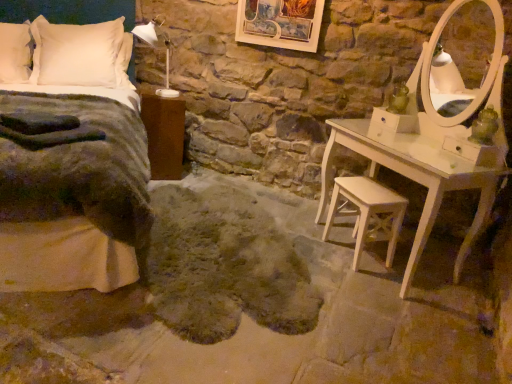
The image size is (512, 384). What do you see at coordinates (368, 211) in the screenshot? I see `white wood stool at lower right` at bounding box center [368, 211].

Locate an element on the screen. The height and width of the screenshot is (384, 512). white wood stool at lower right is located at coordinates (368, 211).

What do you see at coordinates (164, 134) in the screenshot? I see `brown wood nightstand at left` at bounding box center [164, 134].

What is the approximate width of wooden picture frame at upper center?

wooden picture frame at upper center is 1.21 inches wide.

This screenshot has height=384, width=512. Describe the element at coordinates (15, 53) in the screenshot. I see `white soft pillow at upper left, placed as the 2th pillow when sorted from right to left` at that location.

Where is `white wood stool at lower right`? This screenshot has width=512, height=384. white wood stool at lower right is located at coordinates (368, 211).

What's the angular difference between white soft pillow at upper left, placed as the 1th pillow when sorted from left to right, and fuzzy gray rug at center's facing directions?

white soft pillow at upper left, placed as the 1th pillow when sorted from left to right, and fuzzy gray rug at center are facing 3.74 degrees away from each other.

Does white soft pillow at upper left, placed as the 1th pillow when sorted from left to right, touch fuzzy gray rug at center?

Result: No, white soft pillow at upper left, placed as the 1th pillow when sorted from left to right, is not with fuzzy gray rug at center.

Between white soft pillow at upper left, placed as the 2th pillow when sorted from right to left, and fuzzy gray rug at center, which one has smaller size?

With smaller size is white soft pillow at upper left, placed as the 2th pillow when sorted from right to left.

From the image's perspective, is white soft pillow at upper left, placed as the 1th pillow when sorted from left to right, located above or below white plastic lamp at upper left?

Based on their image positions, white soft pillow at upper left, placed as the 1th pillow when sorted from left to right, is located above white plastic lamp at upper left.

Can you tell me how much white soft pillow at upper left, placed as the 1th pillow when sorted from left to right, and white plastic lamp at upper left differ in facing direction?

The angular difference between white soft pillow at upper left, placed as the 1th pillow when sorted from left to right, and white plastic lamp at upper left is 42 degrees.

From a real-world perspective, relative to white plastic lamp at upper left, is white soft pillow at upper left, placed as the 2th pillow when sorted from right to left, vertically above or below?

white soft pillow at upper left, placed as the 2th pillow when sorted from right to left, is situated lower than white plastic lamp at upper left in the real world.

Is white soft pillow at upper left, placed as the 2th pillow when sorted from right to left, smaller than white plastic lamp at upper left?

No, white soft pillow at upper left, placed as the 2th pillow when sorted from right to left, is not smaller than white plastic lamp at upper left.

Which point is more forward, (370, 189) or (226, 193)?

The point (370, 189) is in front.

Is fuzzy gray rug at center surrounded by white wood stool at lower right?

No, fuzzy gray rug at center is not surrounded by white wood stool at lower right.

Considering the positions of objects white wood stool at lower right and fuzzy gray rug at center in the image provided, who is more to the left, white wood stool at lower right or fuzzy gray rug at center?

A: fuzzy gray rug at center.

Would you say brown wood nightstand at left is a long distance from white plastic lamp at upper left?

They are positioned close to each other.

Does brown wood nightstand at left have a greater height compared to white plastic lamp at upper left?

Correct, brown wood nightstand at left is much taller as white plastic lamp at upper left.

Looking at this image, considering the relative positions of brown wood nightstand at left and white plastic lamp at upper left in the image provided, is brown wood nightstand at left to the left or to the right of white plastic lamp at upper left?

Based on their positions, brown wood nightstand at left is located to the left of white plastic lamp at upper left.

Is brown wood nightstand at left oriented away from white plastic lamp at upper left?

No, brown wood nightstand at left is not facing away from white plastic lamp at upper left.

From the image's perspective, is brown wood nightstand at left above or below wooden picture frame at upper center?

brown wood nightstand at left is situated lower than wooden picture frame at upper center in the image.

Looking at this image, is brown wood nightstand at left positioned far away from wooden picture frame at upper center?

That's not correct — brown wood nightstand at left is a little close to wooden picture frame at upper center.

Does brown wood nightstand at left have a smaller size compared to wooden picture frame at upper center?

Actually, brown wood nightstand at left might be larger than wooden picture frame at upper center.

Which object is more forward, brown wood nightstand at left or wooden picture frame at upper center?

Positioned in front is wooden picture frame at upper center.

Looking at this image, which is less distant, [12,74] or [87,202]?

The point [87,202] is closer to the camera.

Which object is further away from the camera taking this photo, white soft pillow at upper left, placed as the 2th pillow when sorted from right to left, or velvet grey blanket at left?

white soft pillow at upper left, placed as the 2th pillow when sorted from right to left, is further from the camera.

Is white soft pillow at upper left, placed as the 1th pillow when sorted from left to right, inside the boundaries of velvet grey blanket at left, or outside?

white soft pillow at upper left, placed as the 1th pillow when sorted from left to right, is contained in velvet grey blanket at left.

Can you confirm if white soft pillow at upper left, placed as the 2th pillow when sorted from right to left, is smaller than velvet grey blanket at left?

Yes, white soft pillow at upper left, placed as the 2th pillow when sorted from right to left, is smaller than velvet grey blanket at left.

Can you confirm if white soft pillow at upper left, which is the second pillow in left-to-right order, is taller than white plastic lamp at upper left?

Correct, white soft pillow at upper left, which is the second pillow in left-to-right order, is much taller as white plastic lamp at upper left.

Does white soft pillow at upper left, arranged as the first pillow when viewed from the right, lie in front of white plastic lamp at upper left?

That is False.

Who is smaller, white soft pillow at upper left, which is the second pillow in left-to-right order, or white plastic lamp at upper left?

white plastic lamp at upper left is smaller.

Which is more to the left, white soft pillow at upper left, which is the second pillow in left-to-right order, or white plastic lamp at upper left?

From the viewer's perspective, white soft pillow at upper left, which is the second pillow in left-to-right order, appears more on the left side.

At what (x,y) coordinates should I click in order to perform the action: click on animal directly beneath the white soft pillow at upper left, placed as the 2th pillow when sorted from right to left (from a real-world perspective). Please return your answer as a coordinate pair (x, y). Looking at the image, I should click on (224, 266).

Find the location of a particular element. The image size is (512, 384). bedside lamp above the white soft pillow at upper left, placed as the 2th pillow when sorted from right to left (from a real-world perspective) is located at coordinates (148, 30).

In the scene shown: Considering their positions, is white soft pillow at upper left, arranged as the first pillow when viewed from the right, positioned closer to white wood stool at lower right than velvet grey blanket at left?

velvet grey blanket at left is positioned closer to the anchor white wood stool at lower right.

Considering their positions, is white soft pillow at upper left, placed as the 2th pillow when sorted from right to left, positioned closer to brown wood nightstand at left than velvet grey blanket at left?

The object closer to brown wood nightstand at left is velvet grey blanket at left.

When comparing their distances from wooden picture frame at upper center, does white soft pillow at upper left, which is the second pillow in left-to-right order, or white soft pillow at upper left, placed as the 2th pillow when sorted from right to left, seem closer?

Among the two, white soft pillow at upper left, which is the second pillow in left-to-right order, is located nearer to wooden picture frame at upper center.

Looking at the image, which one is located further to white plastic lamp at upper left, fuzzy gray rug at center or white wood stool at lower right?

white wood stool at lower right is positioned further to the anchor white plastic lamp at upper left.

When comparing their distances from white wood stool at lower right, does velvet grey blanket at left or brown wood nightstand at left seem closer?

Among the two, velvet grey blanket at left is located nearer to white wood stool at lower right.

Looking at the image, which one is located closer to velvet grey blanket at left, fuzzy gray rug at center or brown wood nightstand at left?

fuzzy gray rug at center.

Looking at the image, which one is located closer to white plastic lamp at upper left, brown wood nightstand at left or velvet grey blanket at left?

Based on the image, brown wood nightstand at left appears to be nearer to white plastic lamp at upper left.

Estimate the real-world distances between objects in this image. Which object is closer to white soft pillow at upper left, placed as the 1th pillow when sorted from left to right, fuzzy gray rug at center or wooden picture frame at upper center?

Among the two, wooden picture frame at upper center is located nearer to white soft pillow at upper left, placed as the 1th pillow when sorted from left to right.

You are a GUI agent. You are given a task and a screenshot of the screen. Output one action in this format:
    pyautogui.click(x=<x>, y=<y>)
    Task: Click on the picture frame situated between white soft pillow at upper left, arranged as the first pillow when viewed from the right, and white wood stool at lower right from left to right
    
    Given the screenshot: What is the action you would take?
    pyautogui.click(x=280, y=23)

This screenshot has width=512, height=384. I want to click on bedside lamp located between white soft pillow at upper left, placed as the 1th pillow when sorted from left to right, and wooden picture frame at upper center in the left-right direction, so click(x=148, y=30).

Locate an element on the screen. Image resolution: width=512 pixels, height=384 pixels. picture frame situated between white soft pillow at upper left, placed as the 2th pillow when sorted from right to left, and white wood stool at lower right from left to right is located at coordinates (280, 23).

Image resolution: width=512 pixels, height=384 pixels. I want to click on bedside lamp between fuzzy gray rug at center and brown wood nightstand at left in the front-back direction, so click(x=148, y=30).